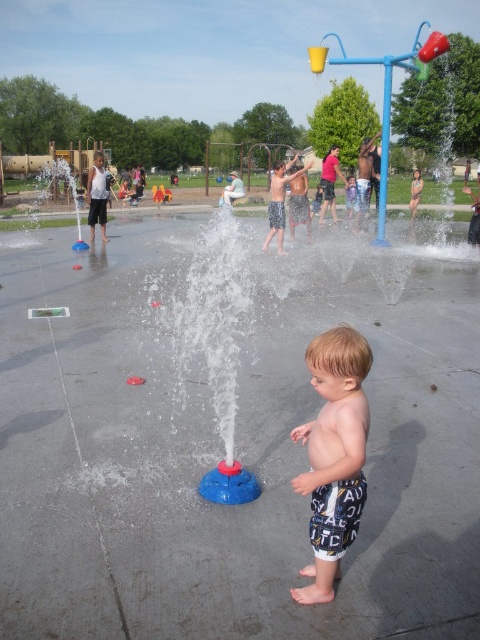
Is light brown hair at center to the right of smooth skin child at center from the viewer's perspective?

In fact, light brown hair at center is to the left of smooth skin child at center.

Between point (323, 467) and point (290, 164), which one is positioned in front?

Point (323, 467) is more forward.

Identify the location of light brown hair at center. coord(334,454).